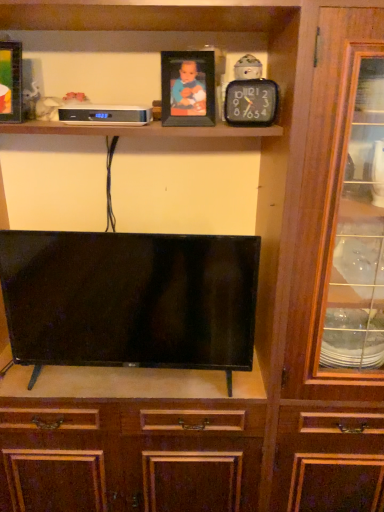
Question: Are wooden photo frame at upper center, which is counted as the first picture frame, starting from the right, and white plastic clock at upper center making contact?

Choices:
 (A) no
 (B) yes

Answer: (A)

Question: Is wooden photo frame at upper center, which is counted as the first picture frame, starting from the right, facing towards white plastic clock at upper center?

Choices:
 (A) yes
 (B) no

Answer: (B)

Question: Considering the relative sizes of wooden photo frame at upper center, the second picture frame from the left, and white plastic clock at upper center in the image provided, is wooden photo frame at upper center, the second picture frame from the left, taller than white plastic clock at upper center?

Choices:
 (A) no
 (B) yes

Answer: (B)

Question: Is wooden photo frame at upper center, which is counted as the first picture frame, starting from the right, turned away from white plastic clock at upper center?

Choices:
 (A) no
 (B) yes

Answer: (A)

Question: From the image's perspective, is wooden photo frame at upper center, the second picture frame from the left, under white plastic clock at upper center?

Choices:
 (A) no
 (B) yes

Answer: (A)

Question: Does wooden photo frame at upper center, which is counted as the first picture frame, starting from the right, lie in front of white plastic clock at upper center?

Choices:
 (A) yes
 (B) no

Answer: (A)

Question: Is black plastic clock at upper center in front of wooden photo frame at upper center, which is counted as the first picture frame, starting from the right?

Choices:
 (A) no
 (B) yes

Answer: (B)

Question: Is black plastic clock at upper center positioned far away from wooden photo frame at upper center, which is counted as the first picture frame, starting from the right?

Choices:
 (A) yes
 (B) no

Answer: (B)

Question: Does black plastic clock at upper center have a larger size compared to wooden photo frame at upper center, the second picture frame from the left?

Choices:
 (A) yes
 (B) no

Answer: (B)

Question: From the image's perspective, is black plastic clock at upper center on wooden photo frame at upper center, the second picture frame from the left?

Choices:
 (A) no
 (B) yes

Answer: (A)

Question: Is black plastic clock at upper center oriented towards wooden photo frame at upper center, the second picture frame from the left?

Choices:
 (A) yes
 (B) no

Answer: (B)

Question: Is black plastic clock at upper center smaller than wooden photo frame at upper center, which is counted as the first picture frame, starting from the right?

Choices:
 (A) yes
 (B) no

Answer: (A)

Question: Considering the relative positions of wooden photo frame at upper center, which is counted as the first picture frame, starting from the right, and black glossy tv at center in the image provided, is wooden photo frame at upper center, which is counted as the first picture frame, starting from the right, to the right of black glossy tv at center from the viewer's perspective?

Choices:
 (A) yes
 (B) no

Answer: (A)